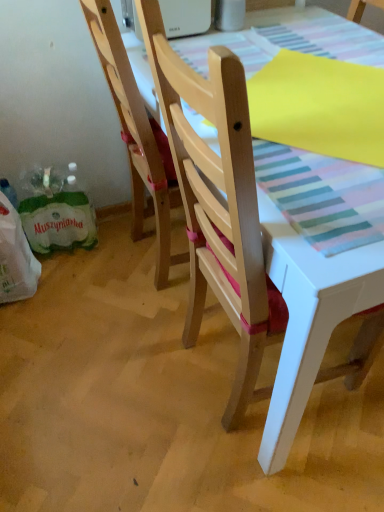
The image size is (384, 512). In order to click on free space to the left of natural wood chair at center, arranged as the second chair when viewed from the right in this screenshot , I will do (90, 272).